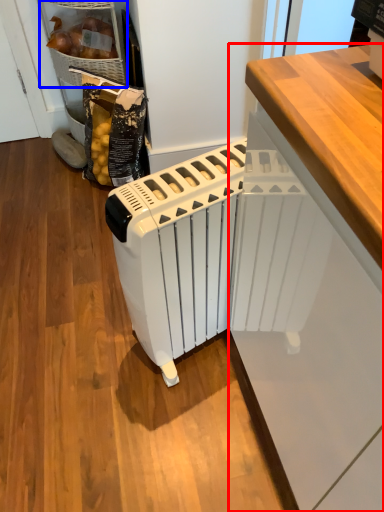
Question: Which object appears closest to the camera in this image, cabinetry (highlighted by a red box) or cabinetry (highlighted by a blue box)?

Choices:
 (A) cabinetry
 (B) cabinetry

Answer: (A)